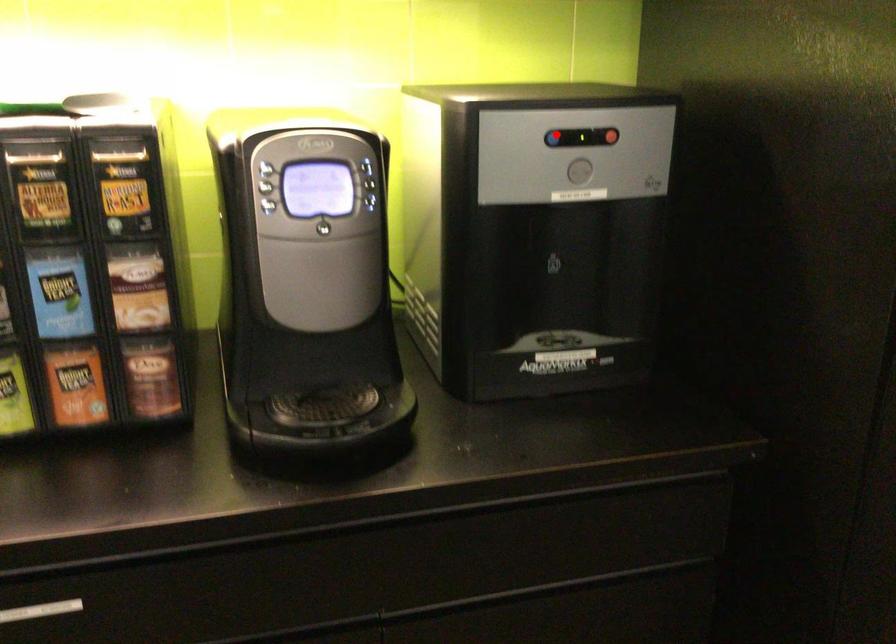
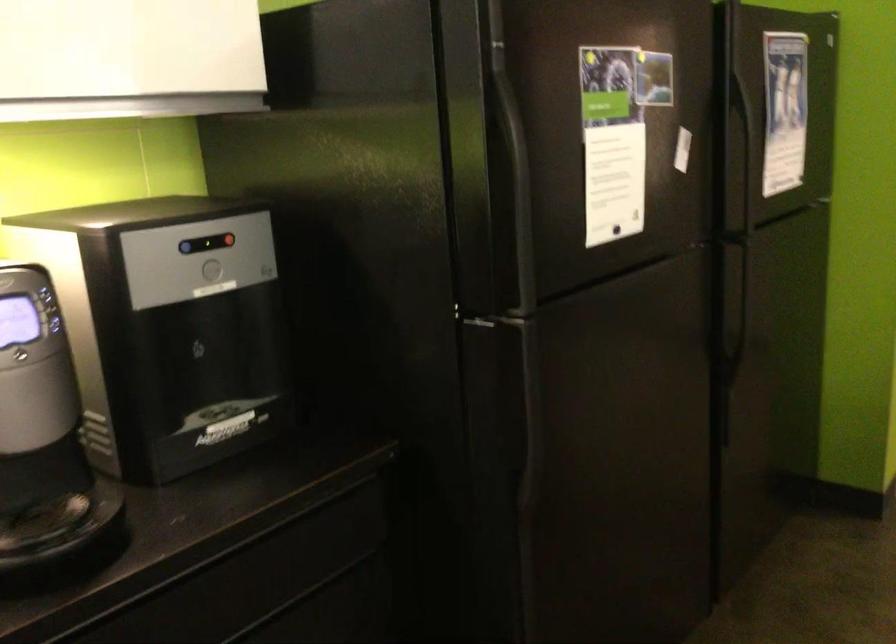
Question: I am providing you with two images of the same scene from different viewpoints. A red point is shown in image1. For the corresponding object point in image2, is it positioned nearer or farther from the camera?

Choices:
 (A) Nearer
 (B) Farther

Answer: (B)